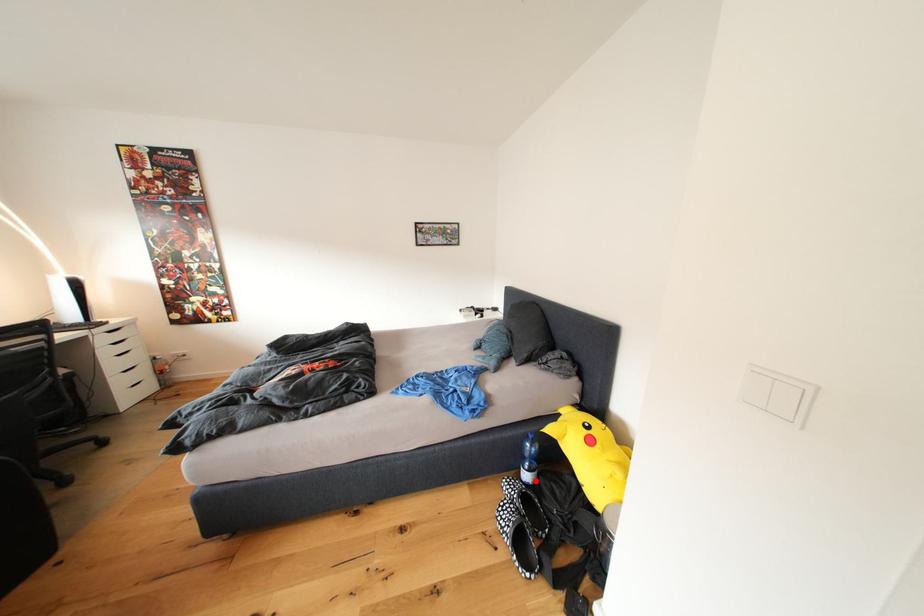
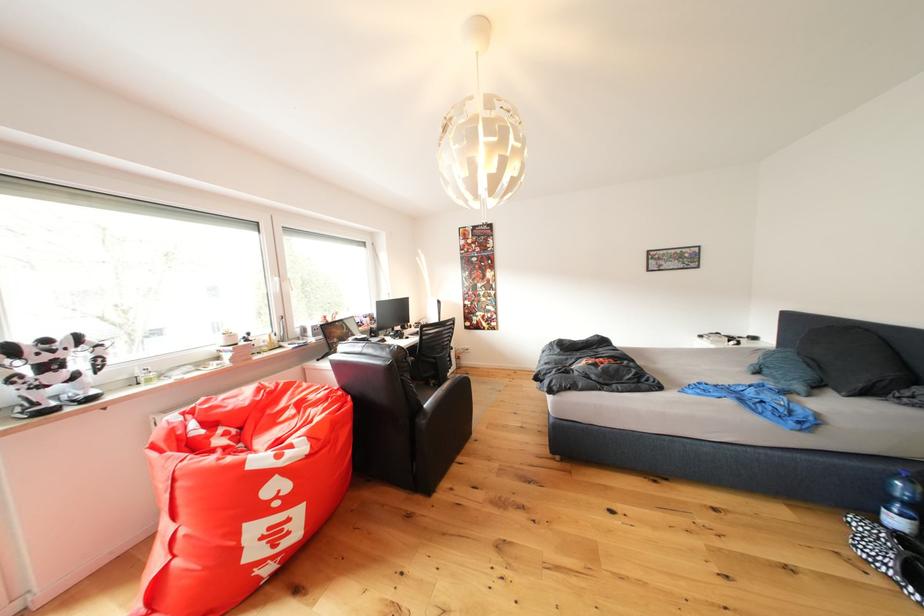
Question: I am providing you with two images of the same scene from different viewpoints. Given a red point in image1, look at the same physical point in image2. Is it:

Choices:
 (A) Closer to the viewpoint
 (B) Farther from the viewpoint

Answer: (A)